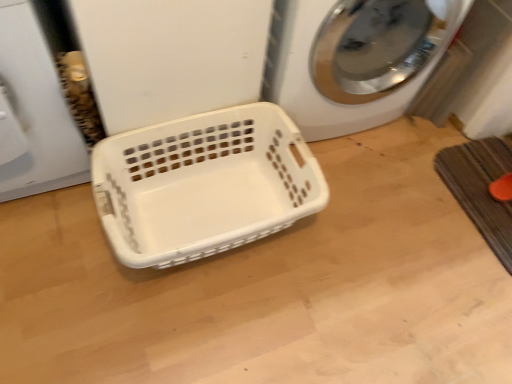
Identify the location of vacant space that's between white plastic basket at center and brown textured bath mat at lower right. The image size is (512, 384). (375, 219).